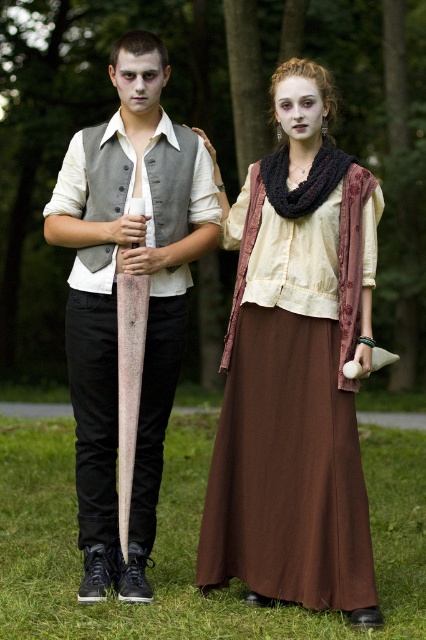
Between matte brown dress at center and matte gray vest at center, which one is positioned higher?

Positioned higher is matte gray vest at center.

Is point (304, 541) positioned before point (152, 65)?

Yes, point (304, 541) is in front of point (152, 65).

Identify the location of matte brown dress at center. Image resolution: width=426 pixels, height=640 pixels. (296, 369).